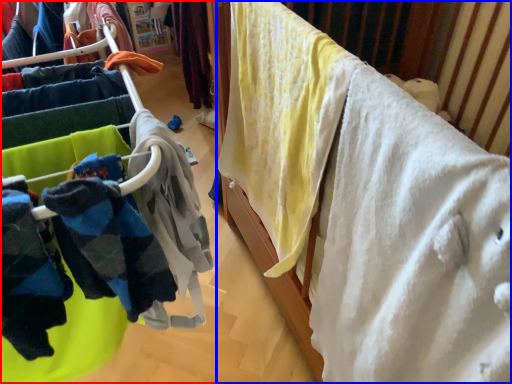
Question: Which of the following is the closest to the observer, closet (highlighted by a red box) or furniture (highlighted by a blue box)?

Choices:
 (A) closet
 (B) furniture

Answer: (A)